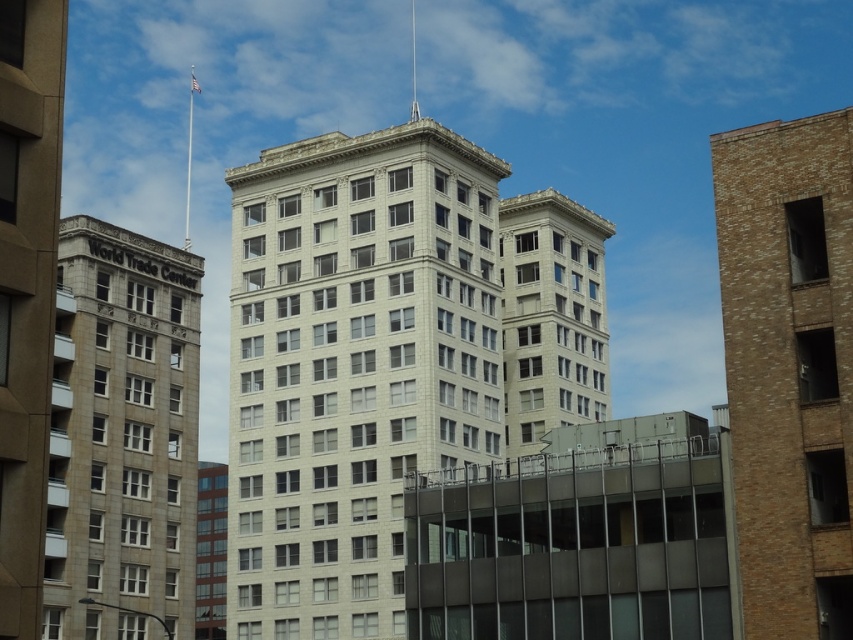
This screenshot has width=853, height=640. What do you see at coordinates (122, 435) in the screenshot?
I see `gray stone building at left` at bounding box center [122, 435].

Who is lower down, gray stone building at left or white stone building at center?

gray stone building at left is below.

Identify the location of gray stone building at left. The height and width of the screenshot is (640, 853). (122, 435).

Is point (718, 156) farther from viewer compared to point (123, 451)?

No, it is not.

Does brown brick building at right have a greater height compared to gray stone building at left?

No, brown brick building at right is not taller than gray stone building at left.

You are a GUI agent. You are given a task and a screenshot of the screen. Output one action in this format:
    pyautogui.click(x=<x>, y=<y>)
    Task: Click on the brown brick building at right
    Image resolution: width=853 pixels, height=640 pixels.
    Given the screenshot: What is the action you would take?
    pyautogui.click(x=788, y=368)

Consider the image. Does brown brick building at right appear on the right side of white stone building at center?

Correct, you'll find brown brick building at right to the right of white stone building at center.

Locate an element on the screen. Image resolution: width=853 pixels, height=640 pixels. brown brick building at right is located at coordinates (788, 368).

Does point (758, 147) come farther from viewer compared to point (563, 314)?

That is False.

You are a GUI agent. You are given a task and a screenshot of the screen. Output one action in this format:
    pyautogui.click(x=<x>, y=<y>)
    Task: Click on the brown brick building at right
    This screenshot has height=640, width=853.
    Given the screenshot: What is the action you would take?
    pyautogui.click(x=788, y=368)